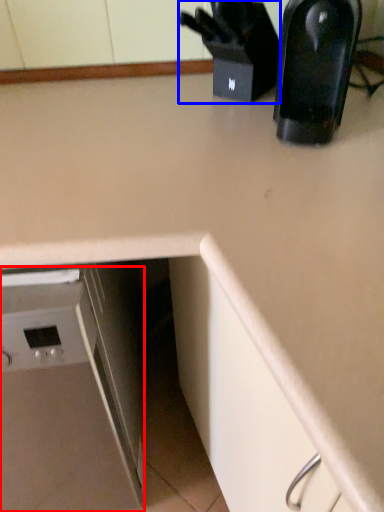
Question: Which of the following is the farthest to the observer, home appliance (highlighted by a red box) or appliance (highlighted by a blue box)?

Choices:
 (A) home appliance
 (B) appliance

Answer: (B)